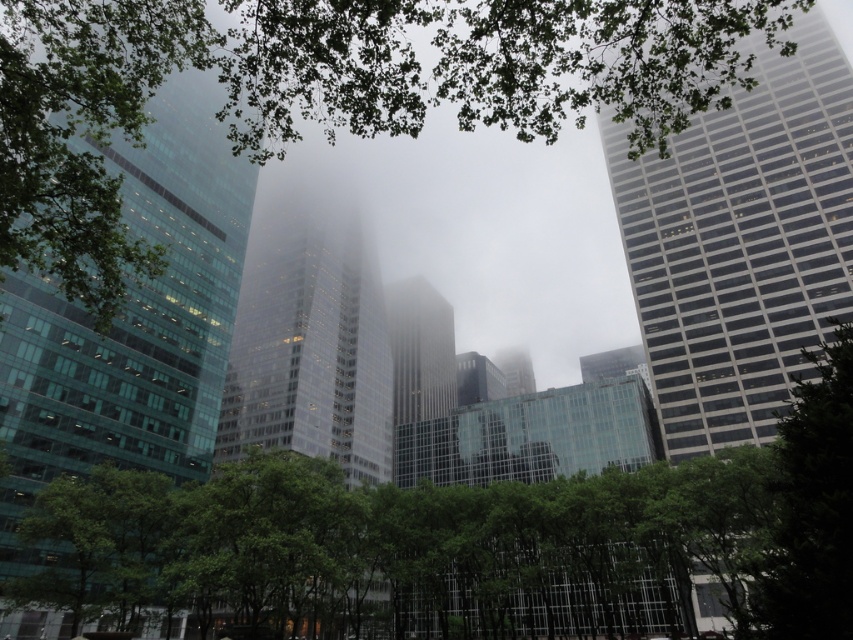
Looking at this image, you are a drone operator trying to navigate between two green leafy trees in a city park. The trees are the green leafy tree at upper center and the green leafy tree at lower left. Which tree is located to the right when viewed from the ground?

Answer: The green leafy tree at upper center is positioned on the right side of the green leafy tree at lower left, so when viewed from the ground, the green leafy tree at upper center is to the right.

You are standing in a park and see the green leafy tree at upper center. If you want to take a photo of it without any obstructions, would you need to move closer or farther away?

The green leafy tree at upper center is 8.36 meters away from the viewer. To take a photo without obstructions, you might need to move farther away to ensure the entire tree fits in the frame, but this depends on your camera lens and desired composition.